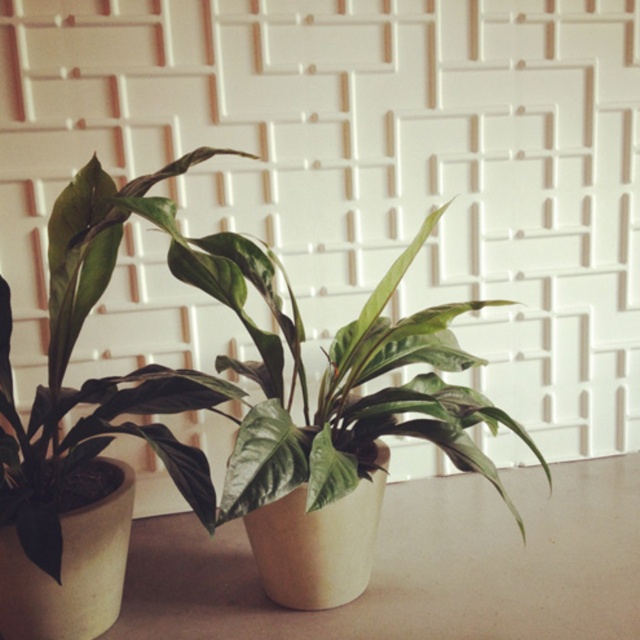
Question: Observing the image, what is the correct spatial positioning of green matte leafy plant at center in reference to green matte leafy plant at left?

Choices:
 (A) below
 (B) above

Answer: (A)

Question: Is beige matte table at center wider than green matte leafy plant at center?

Choices:
 (A) yes
 (B) no

Answer: (A)

Question: Is beige matte table at center to the left of green matte leafy plant at left from the viewer's perspective?

Choices:
 (A) yes
 (B) no

Answer: (B)

Question: Which object is the closest to the green matte leafy plant at center?

Choices:
 (A) green matte leafy plant at left
 (B) beige matte table at center

Answer: (A)

Question: Which point is closer to the camera?

Choices:
 (A) green matte leafy plant at left
 (B) beige matte table at center
 (C) green matte leafy plant at center

Answer: (C)

Question: Which of the following is the closest to the observer?

Choices:
 (A) (408, 433)
 (B) (20, 544)
 (C) (147, 547)

Answer: (B)